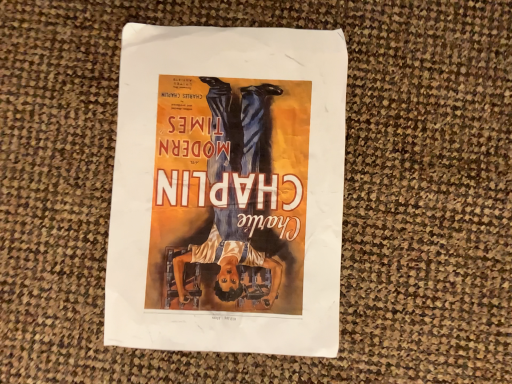
What are the coordinates of `vacant area on top of matte paper poster at center (from a real-world perspective)` in the screenshot? It's located at (222, 180).